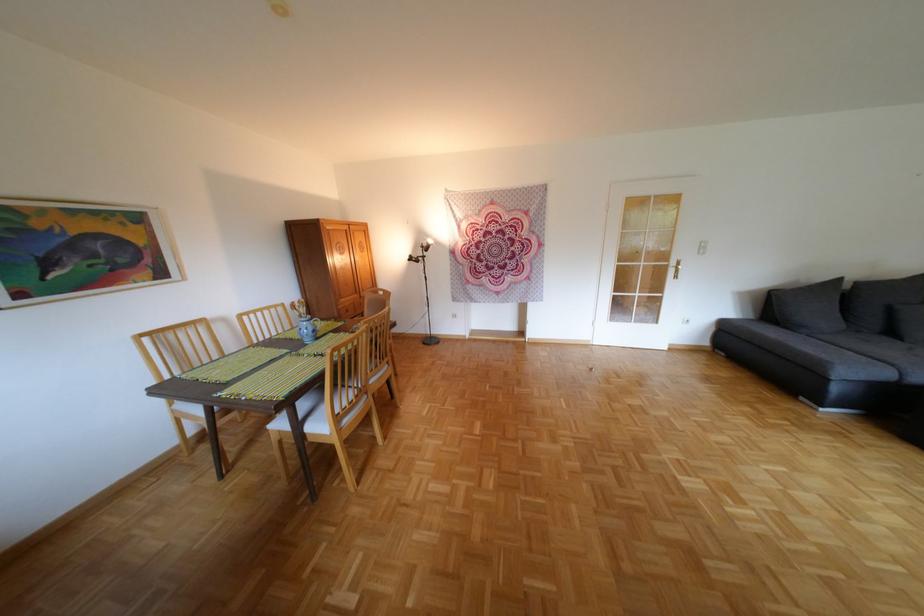
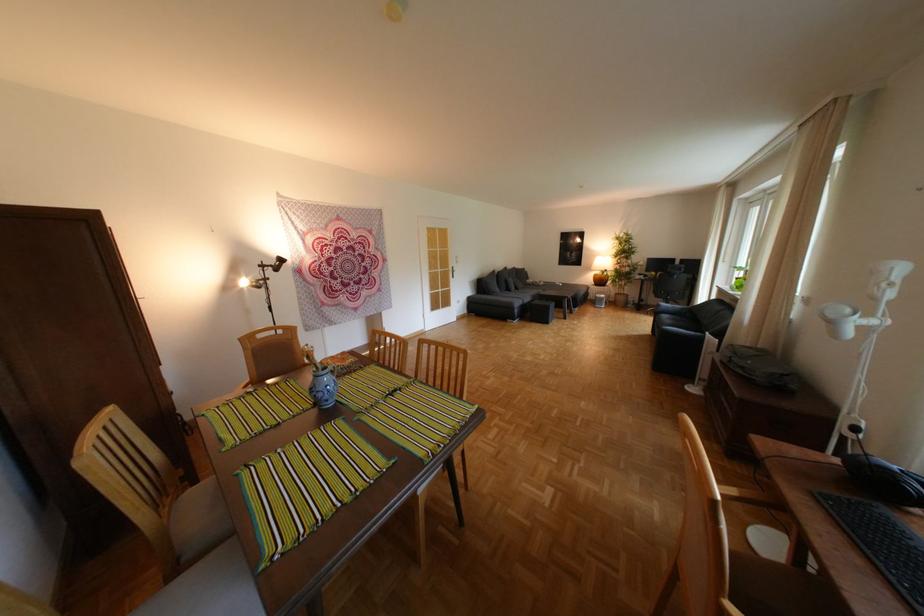
In the second image, find the point that corresponds to (x=849, y=390) in the first image.

(529, 312)